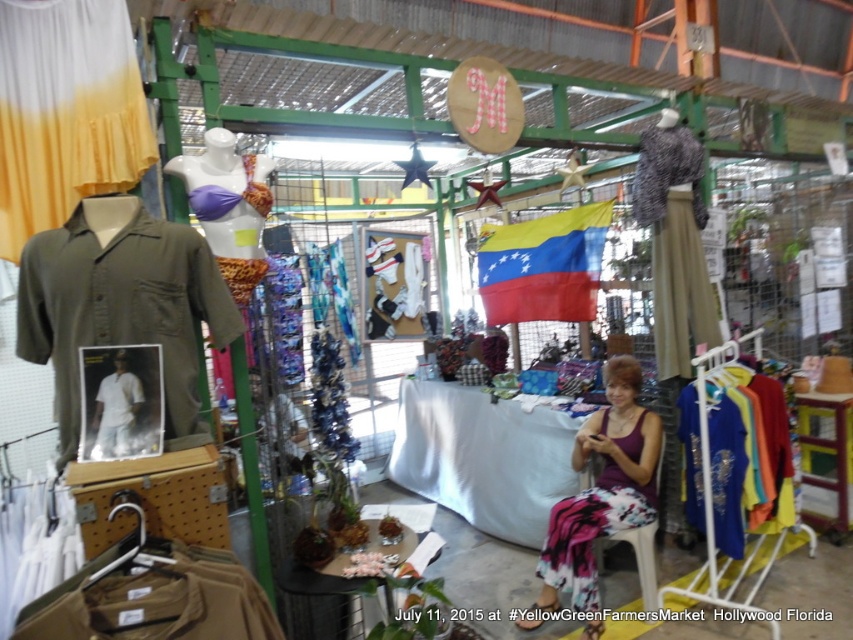
Question: Where is purple floral dress at center located in relation to white cotton shirt at center in the image?

Choices:
 (A) left
 (B) right

Answer: (B)

Question: Can you confirm if olive green fabric shirt at left is wider than purple floral dress at center?

Choices:
 (A) yes
 (B) no

Answer: (B)

Question: Which point is farther from the camera taking this photo?

Choices:
 (A) (100, 253)
 (B) (682, 250)
 (C) (701, 499)
 (D) (595, 451)

Answer: (B)

Question: Which object is positioned closest to the white cotton shirt at center?

Choices:
 (A) olive green fabric shirt at left
 (B) purple floral dress at center
 (C) blue silk blouse at right
 (D) camouflage-patterned fabric skirt at upper right

Answer: (A)

Question: Is tan cotton shirt at lower left smaller than camouflage-patterned fabric skirt at upper right?

Choices:
 (A) yes
 (B) no

Answer: (A)

Question: Among these objects, which one is farthest from the camera?

Choices:
 (A) purple floral dress at center
 (B) camouflage-patterned fabric skirt at upper right
 (C) tan cotton shirt at lower left

Answer: (B)